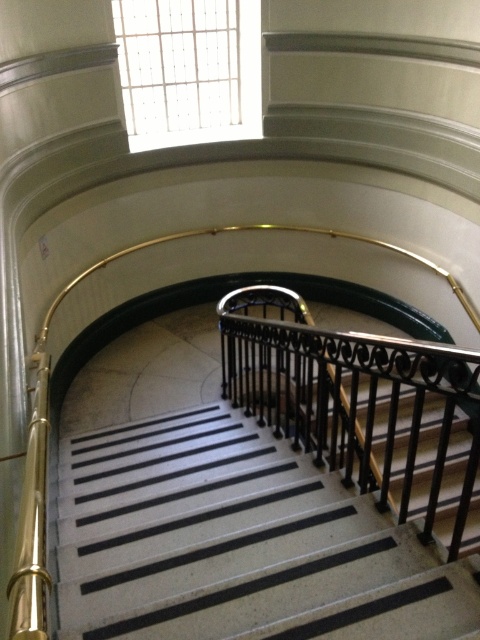
In the scene shown: Who is taller, black textured stairs at center or black wrought iron at center?

With more height is black wrought iron at center.

Image resolution: width=480 pixels, height=640 pixels. Identify the location of black textured stairs at center. (236, 541).

At what (x,y) coordinates should I click in order to perform the action: click on black textured stairs at center. Please return your answer as a coordinate pair (x, y). The height and width of the screenshot is (640, 480). Looking at the image, I should click on (236, 541).